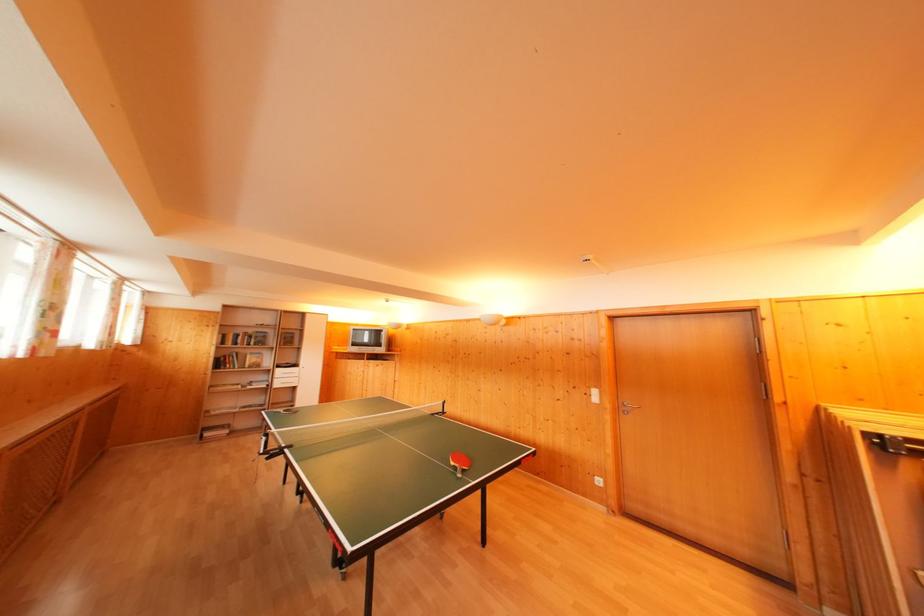
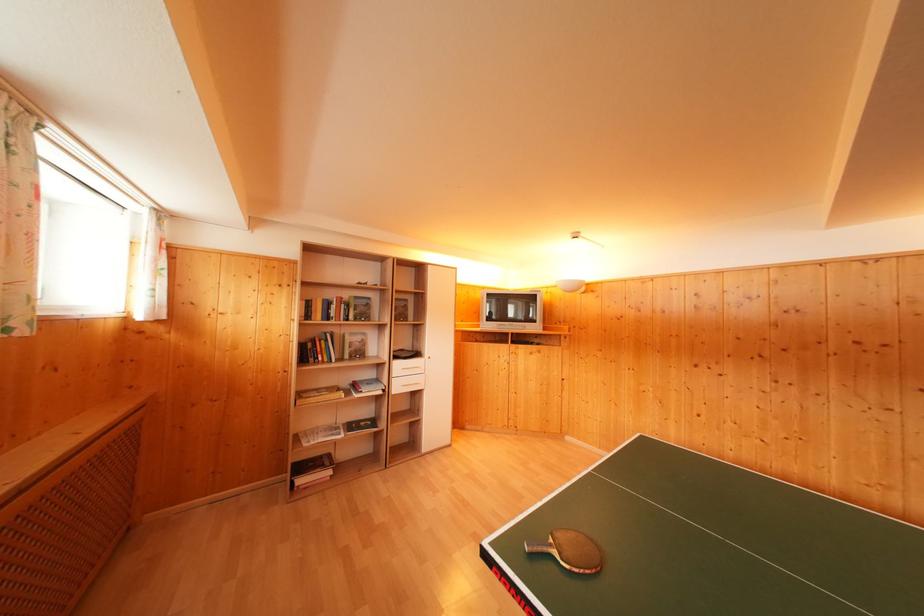
In the second image, find the point that corresponds to point (263, 406) in the first image.

(371, 416)